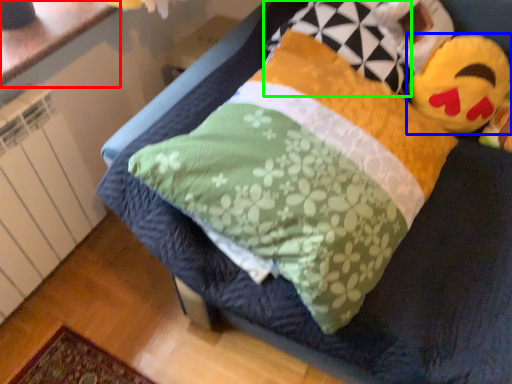
Question: Which object is positioned closest to counter top (highlighted by a red box)? Select from toy (highlighted by a blue box) and pillow (highlighted by a green box).

Choices:
 (A) toy
 (B) pillow

Answer: (B)